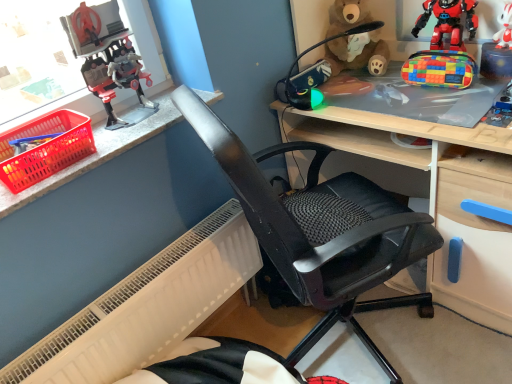
What are the coordinates of `vacant space in black mesh office chair at center (from a real-world perspective)` in the screenshot? It's located at (349, 339).